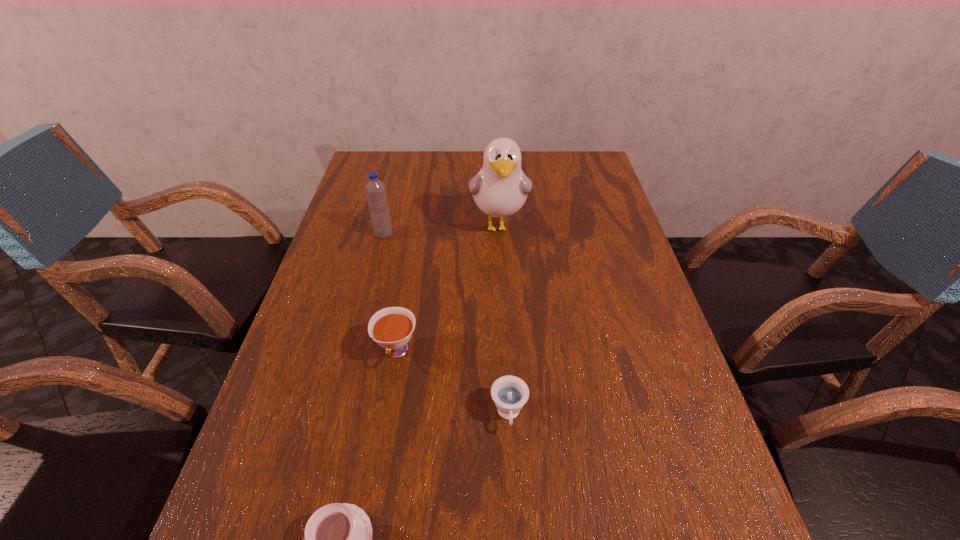
Where is `object positioned at the left edge`? object positioned at the left edge is located at coordinates (375, 190).

This screenshot has width=960, height=540. Identify the location of free space at the left edge of the desktop. (348, 308).

Where is `free space at the right edge`? This screenshot has height=540, width=960. free space at the right edge is located at coordinates (684, 431).

This screenshot has width=960, height=540. What are the coordinates of `vacant space at the far left corner of the desktop` in the screenshot? It's located at (406, 161).

This screenshot has height=540, width=960. Find the location of `free region at the far right corner`. free region at the far right corner is located at coordinates (587, 178).

You are a GUI agent. You are given a task and a screenshot of the screen. Output one action in this format:
    pyautogui.click(x=<x>, y=<y>)
    Task: Click on the vacant area that lies between the gull and the third farthest object
    
    Given the screenshot: What is the action you would take?
    pyautogui.click(x=447, y=288)

This screenshot has width=960, height=540. I want to click on vacant point located between the gull and the fourth shortest object, so click(x=442, y=230).

I want to click on vacant space that is in between the farthest teacup and the gull, so click(447, 288).

Identify which object is located as the second nearest to the tallest object. Please provide its 2D coordinates. Your answer should be formatted as a tuple, i.e. [(x, y)], where the tuple contains the x and y coordinates of a point satisfying the conditions above.

[(392, 327)]

Choose which object is the third nearest neighbor to the nearest teacup. Please provide its 2D coordinates. Your answer should be formatted as a tuple, i.e. [(x, y)], where the tuple contains the x and y coordinates of a point satisfying the conditions above.

[(500, 189)]